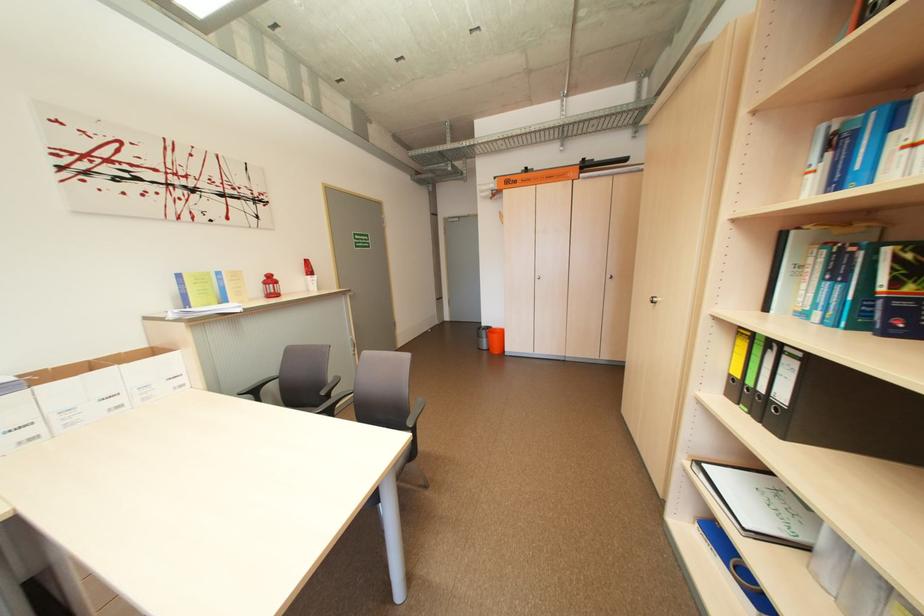
You are a GUI agent. You are given a task and a screenshot of the screen. Output one action in this format:
    pyautogui.click(x=<x>, y=<y>)
    Task: Click on the gray chair sitting surface
    
    Given the screenshot: What is the action you would take?
    pyautogui.click(x=314, y=408)